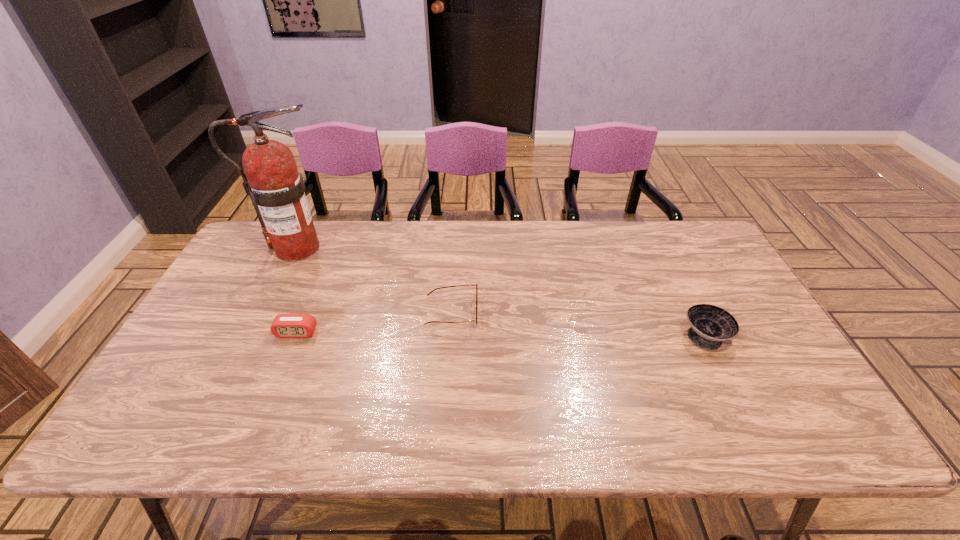
At what (x,y) coordinates should I click in order to perform the action: click on vacant region that satisfies the following two spatial constraints: 1. at the nozzle of the fire extinguisher; 2. on the left side of the rightmost object. Please return your answer as a coordinate pair (x, y). Looking at the image, I should click on (253, 336).

Where is `vacant space that satisfies the following two spatial constraints: 1. on the face of the spectacles; 2. on the right side of the bowl`? vacant space that satisfies the following two spatial constraints: 1. on the face of the spectacles; 2. on the right side of the bowl is located at coordinates (450, 336).

This screenshot has height=540, width=960. Find the location of `vacant point that satisfies the following two spatial constraints: 1. on the face of the spectacles; 2. on the right side of the rightmost object`. vacant point that satisfies the following two spatial constraints: 1. on the face of the spectacles; 2. on the right side of the rightmost object is located at coordinates (450, 336).

The width and height of the screenshot is (960, 540). In order to click on blank area in the image that satisfies the following two spatial constraints: 1. on the face of the spectacles; 2. on the front-facing side of the alarm clock in this screenshot , I will do `click(450, 333)`.

I want to click on vacant point that satisfies the following two spatial constraints: 1. on the face of the second object from right to left; 2. on the back side of the rightmost object, so click(450, 336).

What are the coordinates of `vacant space that satisfies the following two spatial constraints: 1. at the nozzle of the tallest object; 2. on the right side of the rightmost object` in the screenshot? It's located at (253, 336).

This screenshot has width=960, height=540. What are the coordinates of `vacant space that satisfies the following two spatial constraints: 1. at the nozzle of the bowl; 2. on the right side of the fire extinguisher` in the screenshot? It's located at (253, 336).